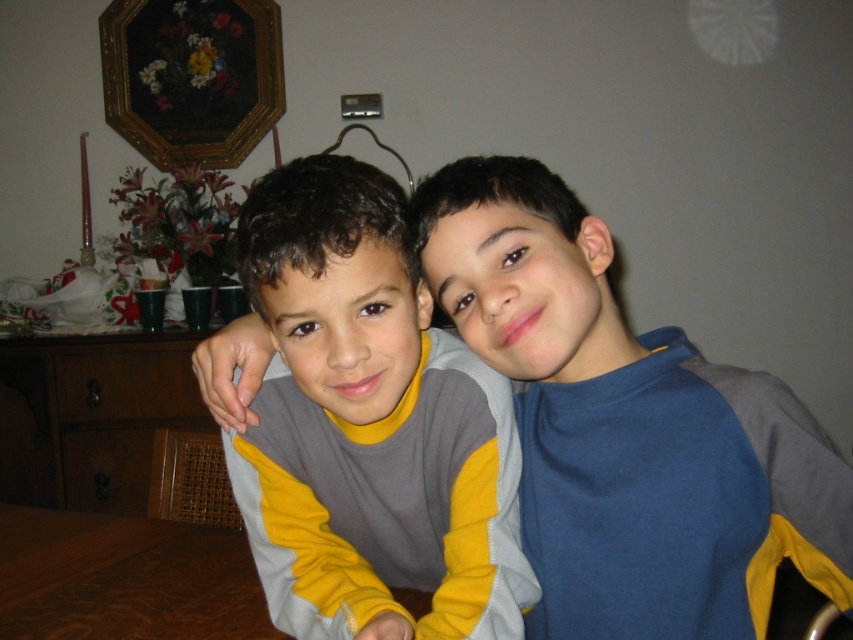
Question: Is gray/yellow sweater at center above wooden table at lower left?

Choices:
 (A) yes
 (B) no

Answer: (A)

Question: Which point is farther to the camera?

Choices:
 (A) (236, 445)
 (B) (15, 545)

Answer: (B)

Question: Considering the relative positions of gray/yellow sweater at center and goldwooden frame at upper left in the image provided, where is gray/yellow sweater at center located with respect to goldwooden frame at upper left?

Choices:
 (A) right
 (B) left

Answer: (A)

Question: Is wooden table at lower left bigger than goldwooden frame at upper left?

Choices:
 (A) no
 (B) yes

Answer: (A)

Question: Which of the following is the closest to the observer?

Choices:
 (A) gray/yellow sweater at center
 (B) wooden table at lower left

Answer: (A)

Question: Which of the following is the farthest from the observer?

Choices:
 (A) (303, 163)
 (B) (194, 67)
 (C) (126, 547)

Answer: (B)